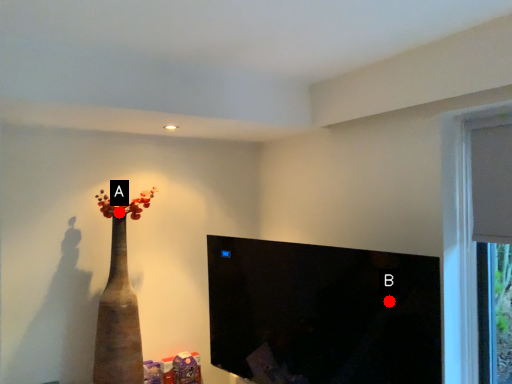
Question: Two points are circled on the image, labeled by A and B beside each circle. Which point appears farthest from the camera in this image?

Choices:
 (A) A is further
 (B) B is further

Answer: (B)